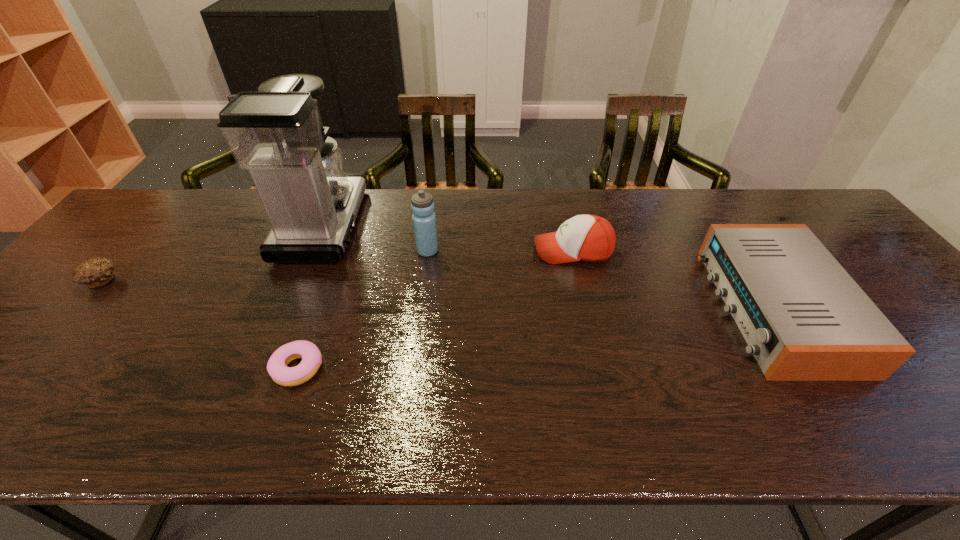
Identify the location of blank space at the far edge of the desktop. The image size is (960, 540). (501, 208).

Locate an element on the screen. This screenshot has width=960, height=540. vacant space at the near edge of the desktop is located at coordinates (483, 402).

The width and height of the screenshot is (960, 540). I want to click on free region at the left edge, so click(x=122, y=278).

I want to click on free location at the right edge, so click(830, 247).

This screenshot has width=960, height=540. I want to click on free location at the far right corner, so click(776, 199).

You are a GUI agent. You are given a task and a screenshot of the screen. Output one action in this format:
    pyautogui.click(x=<x>, y=<y>)
    Task: Click on the free space that is in between the rightmost object and the doughnut
    
    Given the screenshot: What is the action you would take?
    536,338

Where is `vacant area between the fifth object from left to right and the muffin`? The height and width of the screenshot is (540, 960). vacant area between the fifth object from left to right and the muffin is located at coordinates (338, 266).

The image size is (960, 540). I want to click on free area in between the baseball cap and the third object from right to left, so 500,251.

Identify the location of free spot between the radio receiver and the muffin. Image resolution: width=960 pixels, height=540 pixels. (439, 294).

Where is `free space between the baseball cap and the radio receiver`? free space between the baseball cap and the radio receiver is located at coordinates (674, 279).